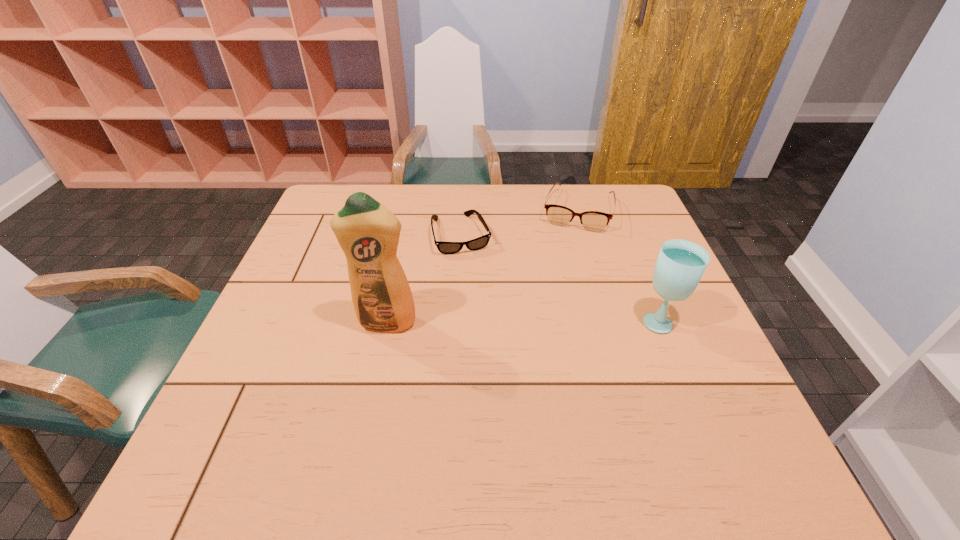
Identify the location of detergent. (368, 233).

Locate an element on the screen. This screenshot has width=960, height=540. the leftmost object is located at coordinates (368, 233).

The height and width of the screenshot is (540, 960). What are the coordinates of `the third shortest object` in the screenshot? It's located at pyautogui.click(x=680, y=265).

This screenshot has width=960, height=540. I want to click on sunglasses, so click(478, 243).

Find the location of a particular element. The width and height of the screenshot is (960, 540). the shortest object is located at coordinates (478, 243).

Find the location of a particular element. The image size is (960, 540). spectacles is located at coordinates point(594,221).

The height and width of the screenshot is (540, 960). I want to click on free space located 0.080m on the label of the tallest object, so click(x=377, y=364).

Locate an element on the screen. The image size is (960, 540). vacant space located on the front of the glass is located at coordinates (673, 354).

Where is `vacant space situated 0.180m on the front-facing side of the second object from left to right`? vacant space situated 0.180m on the front-facing side of the second object from left to right is located at coordinates (484, 301).

Locate an element on the screen. vacant region located on the front-facing side of the second object from left to right is located at coordinates (505, 358).